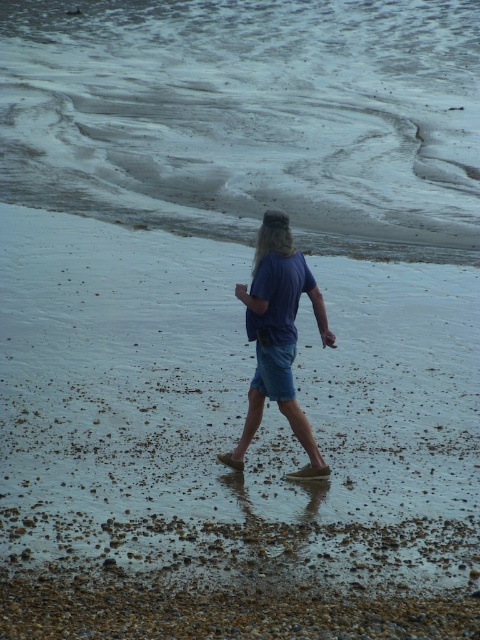
Question: Observing the image, what is the correct spatial positioning of sandy water at center in reference to blue denim shorts at center?

Choices:
 (A) above
 (B) below

Answer: (A)

Question: Which object is the closest to the sandy water at center?

Choices:
 (A) blue denim shorts at center
 (B) blonde hair at center
 (C) smooth sand beach at center

Answer: (C)

Question: Which object is closer to the camera taking this photo?

Choices:
 (A) blonde hair at center
 (B) sandy water at center
 (C) smooth sand beach at center

Answer: (C)

Question: Can you confirm if smooth sand beach at center is smaller than sandy water at center?

Choices:
 (A) no
 (B) yes

Answer: (B)

Question: Estimate the real-world distances between objects in this image. Which object is closer to the smooth sand beach at center?

Choices:
 (A) blonde hair at center
 (B) blue denim shorts at center
 (C) sandy water at center

Answer: (B)

Question: Does sandy water at center come in front of blue denim shorts at center?

Choices:
 (A) no
 (B) yes

Answer: (A)